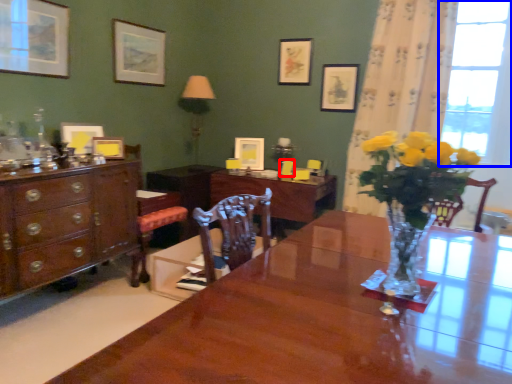
Question: Which object is further to the camera taking this photo, armchair (highlighted by a red box) or window (highlighted by a blue box)?

Choices:
 (A) armchair
 (B) window

Answer: (A)